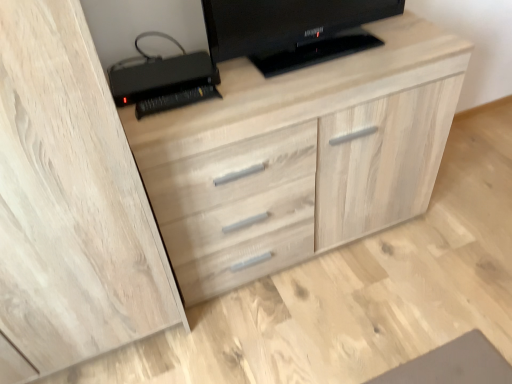
In order to click on blank space situated above black plastic printer at upper left (from a real-world perspective) in this screenshot , I will do `click(167, 70)`.